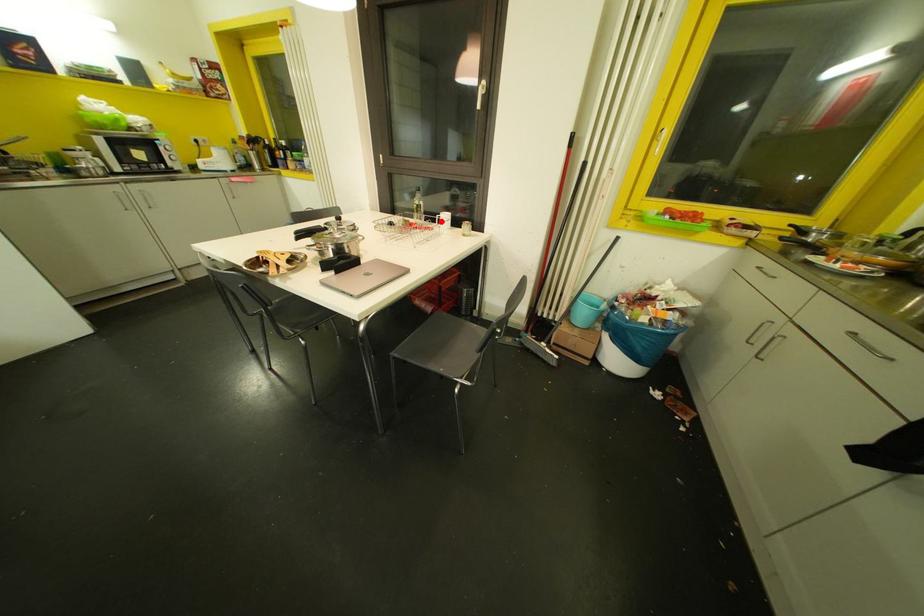
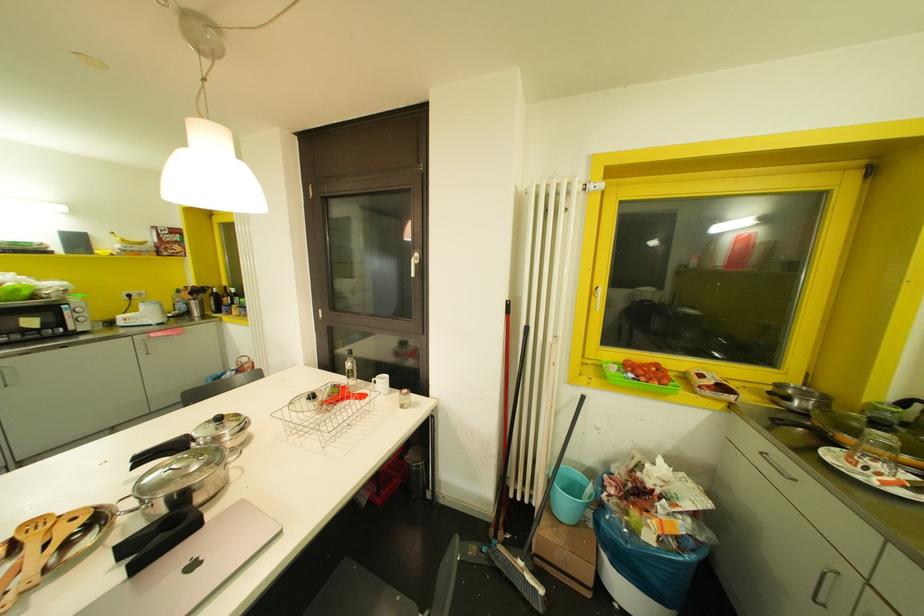
Question: A red point is marked in image1. In image2, is the corresponding 3D point closer to the camera or farther? Reply with the corresponding letter.

Choices:
 (A) The corresponding 3D point is closer.
 (B) The corresponding 3D point is farther.

Answer: (B)